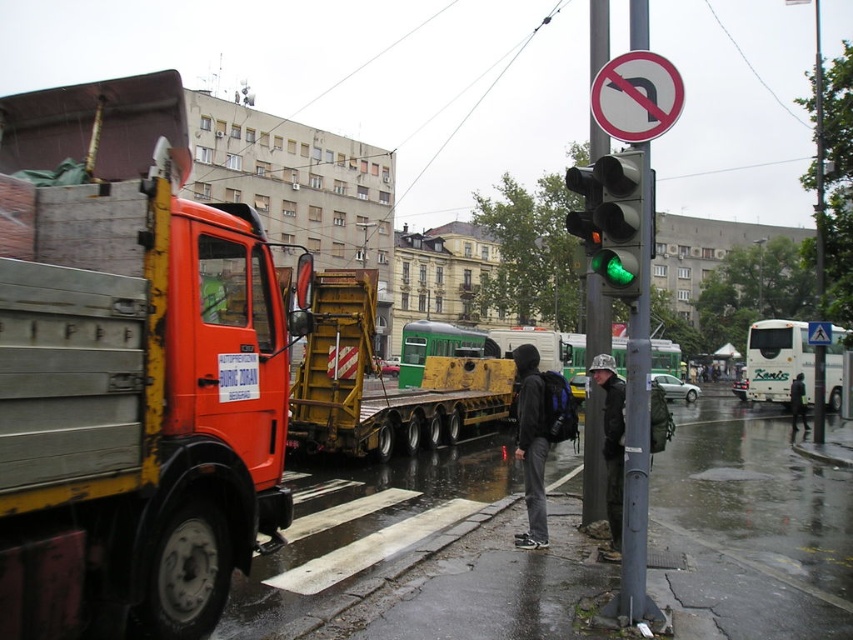
Question: Which point is farther to the camera?

Choices:
 (A) dark gray hoodie at center
 (B) yellow metallic flatbed at center
 (C) metallic pole at center
 (D) green glass traffic light at center

Answer: (A)

Question: In this image, where is orange metallic truck at left located relative to white plastic sign at upper center?

Choices:
 (A) above
 (B) below

Answer: (A)

Question: Is orange metallic truck at left wider than green glass traffic light at center?

Choices:
 (A) yes
 (B) no

Answer: (A)

Question: Where is white plastic sign at upper center located in relation to blue plastic triangle at upper center in the image?

Choices:
 (A) left
 (B) right

Answer: (A)

Question: Which point is closer to the camera?

Choices:
 (A) (796, 410)
 (B) (331, 428)
 (C) (599, 104)

Answer: (C)

Question: Which point is farther from the camera taking this photo?

Choices:
 (A) [527, 477]
 (B) [793, 380]

Answer: (B)